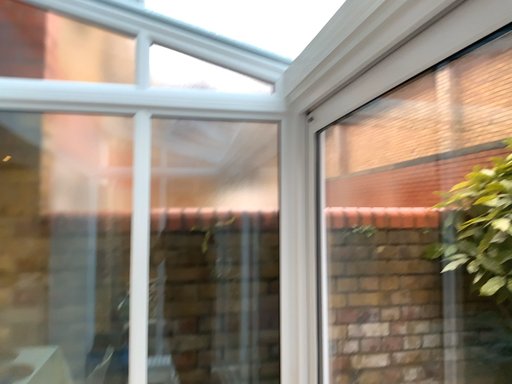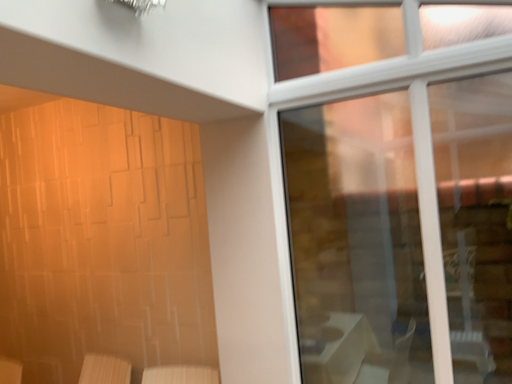
Question: How did the camera likely rotate when shooting the video?

Choices:
 (A) rotated left
 (B) rotated right

Answer: (A)